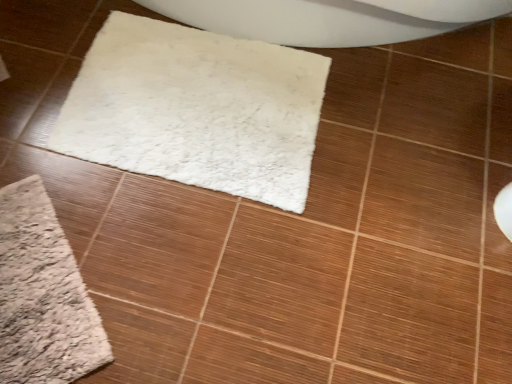
Question: From a real-world perspective, is beige fuzzy bath mat at lower left physically located above or below white fluffy mat at center?

Choices:
 (A) below
 (B) above

Answer: (A)

Question: In terms of width, does beige fuzzy bath mat at lower left look wider or thinner when compared to white fluffy mat at center?

Choices:
 (A) wide
 (B) thin

Answer: (B)

Question: Would you say beige fuzzy bath mat at lower left is inside or outside white fluffy mat at center?

Choices:
 (A) inside
 (B) outside

Answer: (B)

Question: Is point tap(132, 74) positioned closer to the camera than point tap(2, 375)?

Choices:
 (A) farther
 (B) closer

Answer: (A)

Question: Considering the positions of white fluffy mat at center and beige fuzzy bath mat at lower left in the image, is white fluffy mat at center bigger or smaller than beige fuzzy bath mat at lower left?

Choices:
 (A) big
 (B) small

Answer: (A)

Question: From a real-world perspective, is white fluffy mat at center physically located above or below beige fuzzy bath mat at lower left?

Choices:
 (A) below
 (B) above

Answer: (B)

Question: Choose the correct answer: Is white fluffy mat at center inside beige fuzzy bath mat at lower left or outside it?

Choices:
 (A) inside
 (B) outside

Answer: (B)